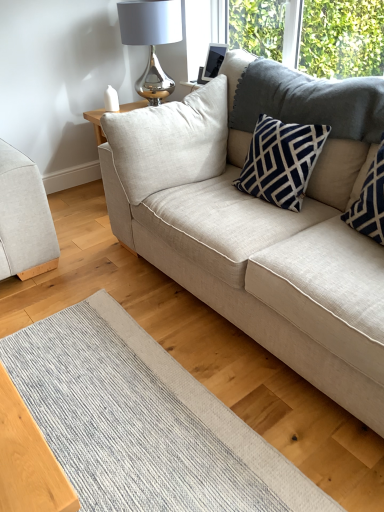
I want to click on empty space that is ontop of textured gray mat at lower center (from a real-world perspective), so click(125, 405).